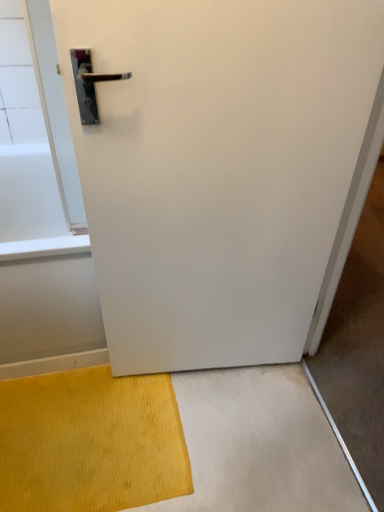
Question: Can you confirm if yellow textured mat at lower left is shorter than white matte door at center?

Choices:
 (A) yes
 (B) no

Answer: (A)

Question: Considering the relative sizes of yellow textured mat at lower left and white matte door at center in the image provided, is yellow textured mat at lower left bigger than white matte door at center?

Choices:
 (A) no
 (B) yes

Answer: (A)

Question: Is yellow textured mat at lower left far away from white matte door at center?

Choices:
 (A) no
 (B) yes

Answer: (A)

Question: From a real-world perspective, is yellow textured mat at lower left under white matte door at center?

Choices:
 (A) no
 (B) yes

Answer: (B)

Question: Does yellow textured mat at lower left appear on the right side of white matte door at center?

Choices:
 (A) yes
 (B) no

Answer: (B)

Question: Can you confirm if yellow textured mat at lower left is smaller than white matte door at center?

Choices:
 (A) yes
 (B) no

Answer: (A)

Question: Considering the relative sizes of white matte door at center and yellow textured mat at lower left in the image provided, is white matte door at center smaller than yellow textured mat at lower left?

Choices:
 (A) no
 (B) yes

Answer: (A)

Question: Does white matte door at center lie in front of yellow textured mat at lower left?

Choices:
 (A) no
 (B) yes

Answer: (B)

Question: Considering the relative positions of white matte door at center and yellow textured mat at lower left in the image provided, is white matte door at center behind yellow textured mat at lower left?

Choices:
 (A) yes
 (B) no

Answer: (B)

Question: From a real-world perspective, is white matte door at center on yellow textured mat at lower left?

Choices:
 (A) no
 (B) yes

Answer: (B)

Question: Is white matte door at center facing away from yellow textured mat at lower left?

Choices:
 (A) yes
 (B) no

Answer: (B)

Question: Does white matte door at center contain yellow textured mat at lower left?

Choices:
 (A) yes
 (B) no

Answer: (B)

Question: Is white matte door at center bigger or smaller than yellow textured mat at lower left?

Choices:
 (A) big
 (B) small

Answer: (A)